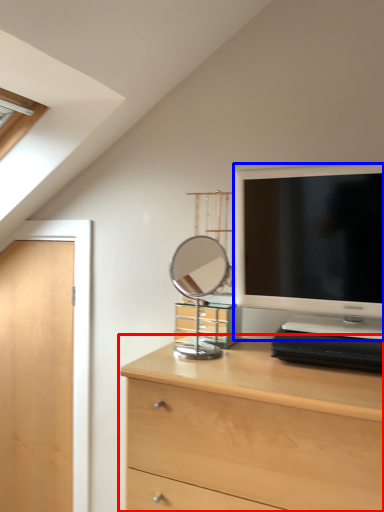
Question: Which of the following is the closest to the observer, chest of drawers (highlighted by a red box) or television (highlighted by a blue box)?

Choices:
 (A) chest of drawers
 (B) television

Answer: (A)